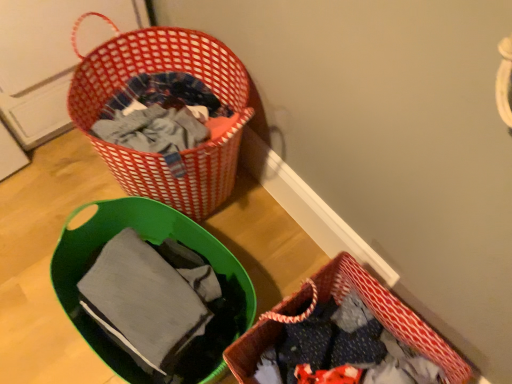
Question: Should I look upward or downward to see matte gray fabric at lower left?

Choices:
 (A) down
 (B) up

Answer: (A)

Question: From a real-world perspective, is red woven picnic basket at lower right, arranged as the 2th picnic basket when viewed from the left, positioned under red woven basket at upper left, the 2th picnic basket ordered from the bottom, based on gravity?

Choices:
 (A) yes
 (B) no

Answer: (A)

Question: From the image's perspective, does red woven picnic basket at lower right, arranged as the 2th picnic basket when viewed from the left, appear lower than red woven basket at upper left, the second picnic basket viewed from the right?

Choices:
 (A) no
 (B) yes

Answer: (B)

Question: Is red woven picnic basket at lower right, arranged as the 2th picnic basket when viewed from the left, at the right side of red woven basket at upper left, the 2th picnic basket ordered from the bottom?

Choices:
 (A) yes
 (B) no

Answer: (A)

Question: Is red woven picnic basket at lower right, which ranks as the 2th picnic basket in top-to-bottom order, oriented towards red woven basket at upper left, the 2th picnic basket ordered from the bottom?

Choices:
 (A) yes
 (B) no

Answer: (B)

Question: Is red woven picnic basket at lower right, arranged as the 2th picnic basket when viewed from the left, facing away from red woven basket at upper left, placed as the first picnic basket when sorted from left to right?

Choices:
 (A) yes
 (B) no

Answer: (B)

Question: Is red woven picnic basket at lower right, arranged as the 2th picnic basket when viewed from the left, outside red woven basket at upper left, the first picnic basket when ordered from top to bottom?

Choices:
 (A) yes
 (B) no

Answer: (A)

Question: Is red woven picnic basket at lower right, arranged as the 2th picnic basket when viewed from the left, next to matte gray fabric at lower left?

Choices:
 (A) no
 (B) yes

Answer: (A)

Question: From a real-world perspective, is red woven picnic basket at lower right, arranged as the 2th picnic basket when viewed from the left, located beneath matte gray fabric at lower left?

Choices:
 (A) no
 (B) yes

Answer: (B)

Question: Is red woven picnic basket at lower right, which ranks as the 2th picnic basket in top-to-bottom order, bigger than matte gray fabric at lower left?

Choices:
 (A) yes
 (B) no

Answer: (A)

Question: From the image's perspective, is red woven picnic basket at lower right, which ranks as the 2th picnic basket in top-to-bottom order, under matte gray fabric at lower left?

Choices:
 (A) yes
 (B) no

Answer: (A)

Question: Considering the relative sizes of red woven picnic basket at lower right, which ranks as the 2th picnic basket in top-to-bottom order, and matte gray fabric at lower left in the image provided, is red woven picnic basket at lower right, which ranks as the 2th picnic basket in top-to-bottom order, wider than matte gray fabric at lower left?

Choices:
 (A) no
 (B) yes

Answer: (B)

Question: Is red woven picnic basket at lower right, which ranks as the 2th picnic basket in top-to-bottom order, oriented away from matte gray fabric at lower left?

Choices:
 (A) no
 (B) yes

Answer: (A)

Question: Does red woven basket at upper left, the 2th picnic basket ordered from the bottom, have a lesser width compared to red woven picnic basket at lower right, arranged as the 2th picnic basket when viewed from the left?

Choices:
 (A) yes
 (B) no

Answer: (B)